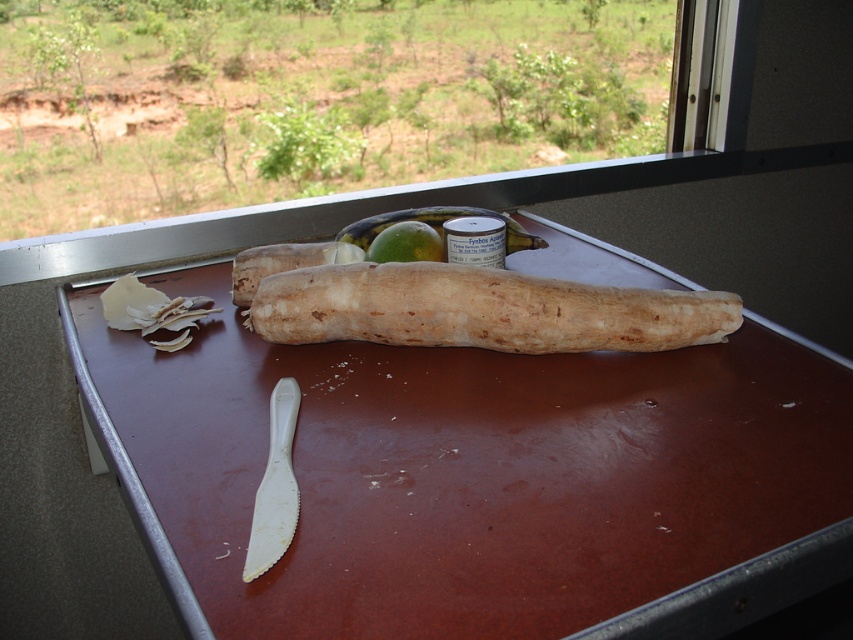
Describe the element at coordinates (479, 480) in the screenshot. I see `brown matte table at center` at that location.

Does point (647, 520) come farther from viewer compared to point (376, 305)?

No, it is not.

This screenshot has height=640, width=853. I want to click on brown matte table at center, so click(x=479, y=480).

Locate an element on the screen. This screenshot has height=640, width=853. brown matte table at center is located at coordinates (479, 480).

Between brown rough textured root vegetable at center and green matte apple at center, which one is positioned higher?

green matte apple at center is above.

Does brown rough textured root vegetable at center have a lesser height compared to green matte apple at center?

Incorrect, brown rough textured root vegetable at center's height does not fall short of green matte apple at center's.

The height and width of the screenshot is (640, 853). Find the location of `brown rough textured root vegetable at center`. brown rough textured root vegetable at center is located at coordinates click(x=480, y=308).

Consider the image. Who is higher up, brown matte table at center or green matte apple at center?

green matte apple at center

Describe the element at coordinates (479, 480) in the screenshot. This screenshot has height=640, width=853. I see `brown matte table at center` at that location.

This screenshot has height=640, width=853. Identify the location of brown matte table at center. (479, 480).